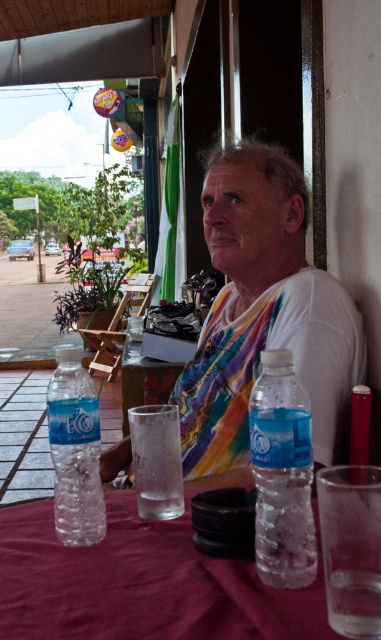
Question: Estimate the real-world distances between objects in this image. Which object is closer to the transparent glass at table right?

Choices:
 (A) clear plastic bottle at lower center
 (B) white matte shirt at center
 (C) maroon fabric tablecloth at lower center

Answer: (A)

Question: Is white matte shirt at center to the right of transparent glass at table right from the viewer's perspective?

Choices:
 (A) no
 (B) yes

Answer: (A)

Question: Which object is positioned closest to the clear glass at center?

Choices:
 (A) clear glass water at center
 (B) transparent glass at table right
 (C) white matte shirt at center
 (D) clear plastic bottle at lower center

Answer: (C)

Question: Where is transparent glass at table right located in relation to clear plastic bottle at lower left in the image?

Choices:
 (A) below
 (B) above

Answer: (A)

Question: Is white matte shirt at center to the right of maroon fabric tablecloth at lower center from the viewer's perspective?

Choices:
 (A) yes
 (B) no

Answer: (A)

Question: Which point appears farthest from the camera in this image?

Choices:
 (A) (264, 592)
 (B) (131, 352)
 (C) (76, 385)
 (D) (256, 298)

Answer: (B)